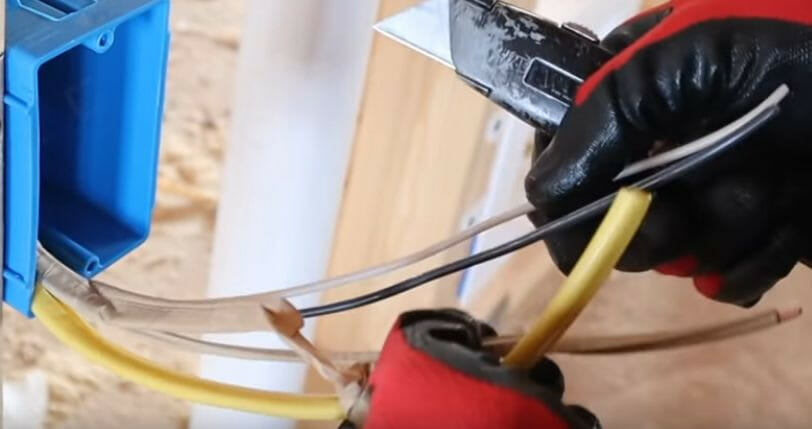
The height and width of the screenshot is (429, 812). Find the location of `wooden board`. wooden board is located at coordinates (461, 177).